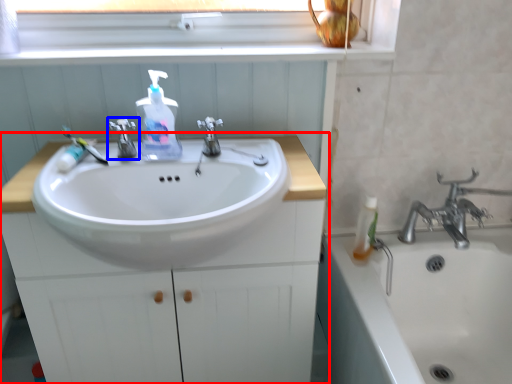
Question: Which object is closer to the camera taking this photo, bathroom cabinet (highlighted by a red box) or tap (highlighted by a blue box)?

Choices:
 (A) bathroom cabinet
 (B) tap

Answer: (A)